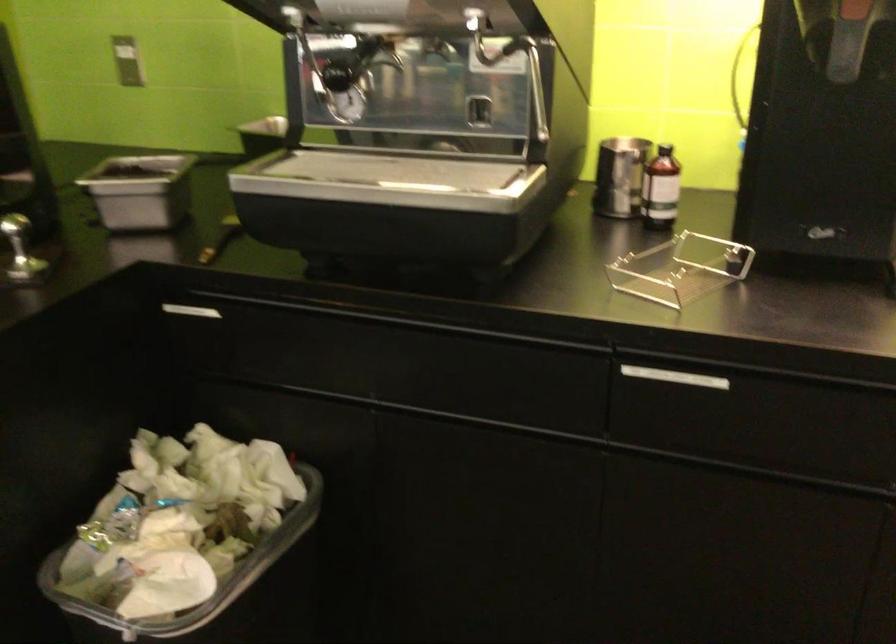
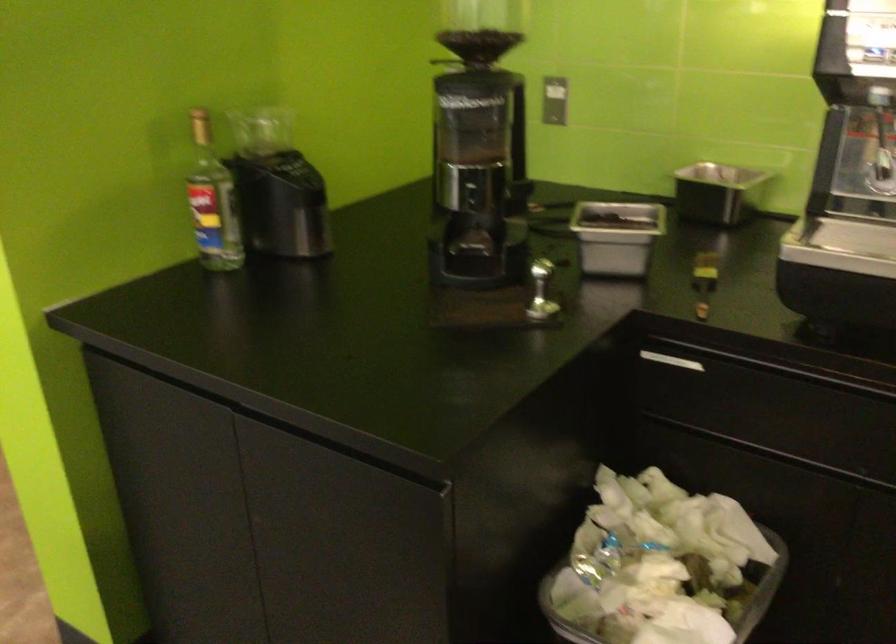
Question: Based on the continuous images, in which direction is the camera rotating? Reply with the corresponding letter.

Choices:
 (A) Left
 (B) Right
 (C) Up
 (D) Down

Answer: (A)